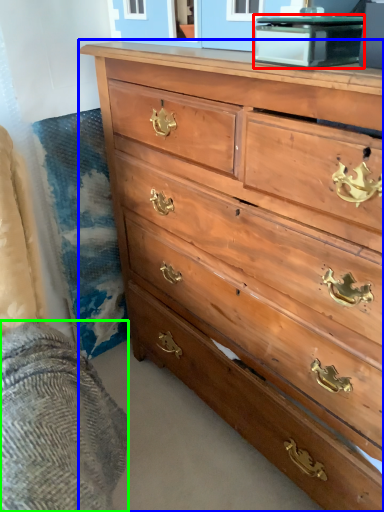
Question: Considering the real-world distances, which object is closest to cabinetry (highlighted by a red box)? chest of drawers (highlighted by a blue box) or bedding (highlighted by a green box).

Choices:
 (A) chest of drawers
 (B) bedding

Answer: (A)